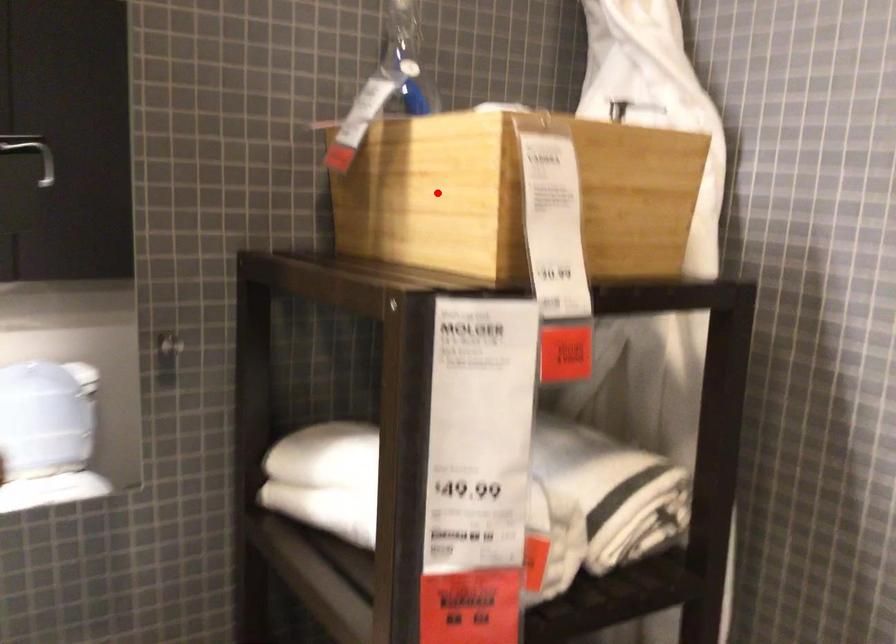
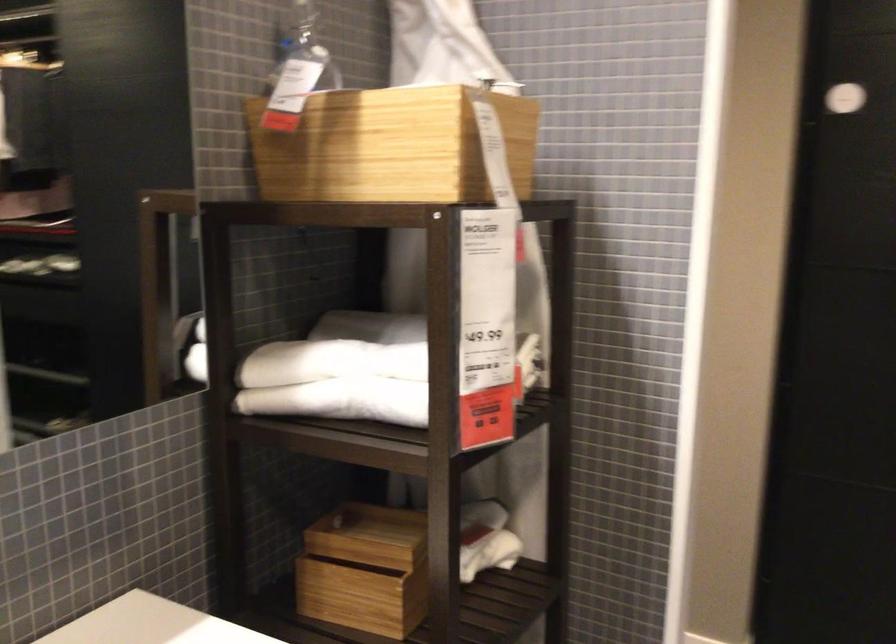
Question: I am providing you with two images of the same scene from different viewpoints. Given a red point in image1, look at the same physical point in image2. Is it:

Choices:
 (A) Closer to the viewpoint
 (B) Farther from the viewpoint

Answer: (B)